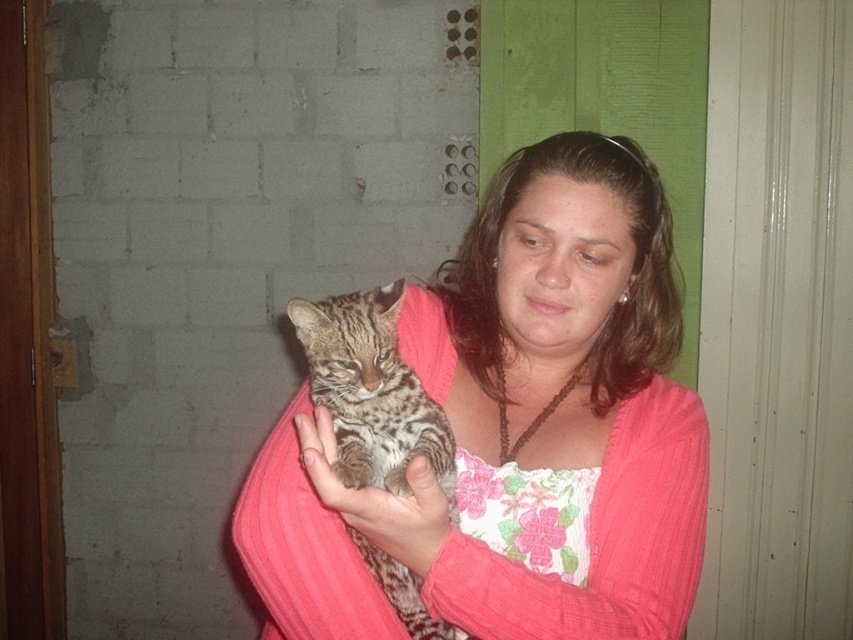
Question: Estimate the real-world distances between objects in this image. Which object is closer to the fluffy fur cat at center?

Choices:
 (A) spotted fur cat at center
 (B) pink ribbed sweater at center
 (C) soft fur paw at center

Answer: (B)

Question: Which point is closer to the camera?

Choices:
 (A) spotted fur cat at center
 (B) soft fur paw at center
 (C) pink ribbed sweater at center

Answer: (C)

Question: Which object is farther from the camera taking this photo?

Choices:
 (A) pink ribbed sweater at center
 (B) soft fur paw at center
 (C) spotted fur cat at center
 (D) fluffy fur cat at center

Answer: (C)

Question: Can you confirm if spotted fur cat at center is positioned to the right of soft fur paw at center?

Choices:
 (A) yes
 (B) no

Answer: (B)

Question: Where is pink ribbed sweater at center located in relation to spotted fur cat at center in the image?

Choices:
 (A) right
 (B) left

Answer: (A)

Question: Can you confirm if pink ribbed sweater at center is bigger than spotted fur cat at center?

Choices:
 (A) yes
 (B) no

Answer: (A)